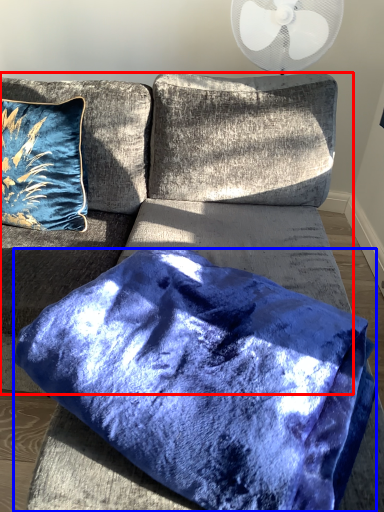
Question: Which point is further to the camera, couch (highlighted by a red box) or pillow (highlighted by a blue box)?

Choices:
 (A) couch
 (B) pillow

Answer: (B)